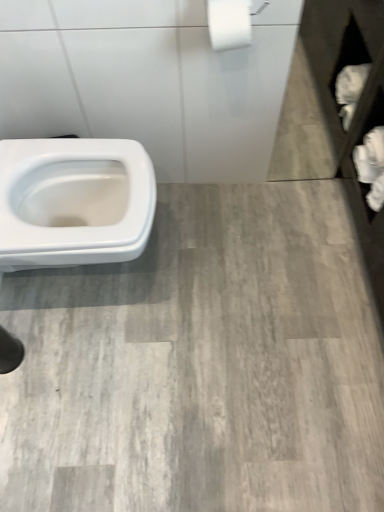
Question: From a real-world perspective, does white matte toilet paper at right, the second toilet paper viewed from the top, sit lower than white matte toilet paper at upper right, placed as the 2th toilet paper when sorted from bottom to top?

Choices:
 (A) yes
 (B) no

Answer: (A)

Question: From the image's perspective, would you say white matte toilet paper at right, the 1th toilet paper from the back, is positioned over white matte toilet paper at upper right, placed as the first toilet paper when sorted from left to right?

Choices:
 (A) no
 (B) yes

Answer: (A)

Question: Considering the relative sizes of white matte toilet paper at right, the second toilet paper viewed from the top, and white matte toilet paper at upper right, placed as the first toilet paper when sorted from front to back, in the image provided, is white matte toilet paper at right, the second toilet paper viewed from the top, bigger than white matte toilet paper at upper right, placed as the first toilet paper when sorted from front to back,?

Choices:
 (A) no
 (B) yes

Answer: (B)

Question: From a real-world perspective, is white matte toilet paper at right, placed as the first toilet paper when sorted from bottom to top, over white matte toilet paper at upper right, placed as the 2th toilet paper when sorted from bottom to top?

Choices:
 (A) no
 (B) yes

Answer: (A)

Question: Is white matte toilet paper at right, the second toilet paper viewed from the top, aimed at white matte toilet paper at upper right, the 2th toilet paper positioned from the back?

Choices:
 (A) yes
 (B) no

Answer: (B)

Question: Does white matte toilet paper at right, the 2th toilet paper from the left, appear on the left side of white matte toilet paper at upper right, placed as the first toilet paper when sorted from front to back?

Choices:
 (A) no
 (B) yes

Answer: (A)

Question: Does white matte toilet paper at upper right, placed as the 2th toilet paper when sorted from bottom to top, have a greater height compared to white matte toilet paper at right, placed as the 2th toilet paper when sorted from front to back?

Choices:
 (A) no
 (B) yes

Answer: (A)

Question: From a real-world perspective, is white matte toilet paper at upper right, placed as the 2th toilet paper when sorted from bottom to top, physically below white matte toilet paper at right, the 2th toilet paper from the left?

Choices:
 (A) no
 (B) yes

Answer: (A)

Question: Does white matte toilet paper at upper right, placed as the 2th toilet paper when sorted from bottom to top, have a larger size compared to white matte toilet paper at right, the 1th toilet paper from the back?

Choices:
 (A) no
 (B) yes

Answer: (A)

Question: From a real-world perspective, is white matte toilet paper at upper right, placed as the first toilet paper when sorted from front to back, physically above white matte toilet paper at right, the 2th toilet paper from the left?

Choices:
 (A) no
 (B) yes

Answer: (B)

Question: Does white matte toilet paper at upper right, placed as the 2th toilet paper when sorted from bottom to top, come behind white matte toilet paper at right, the 2th toilet paper from the left?

Choices:
 (A) no
 (B) yes

Answer: (A)

Question: Is white matte toilet paper at upper right, placed as the 2th toilet paper when sorted from bottom to top, positioned beyond the bounds of white matte toilet paper at right, placed as the 2th toilet paper when sorted from front to back?

Choices:
 (A) yes
 (B) no

Answer: (A)

Question: From a real-world perspective, is white matte toilet paper at right, the 1th toilet paper from the back, positioned above or below white matte toilet paper at upper right, placed as the first toilet paper when sorted from front to back?

Choices:
 (A) below
 (B) above

Answer: (A)